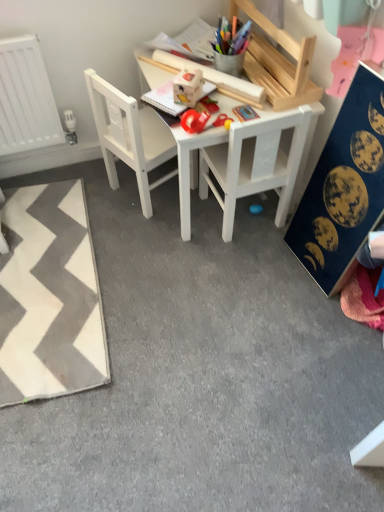
Question: Is white zigzag rug at lower left inside or outside of white wooden table at center?

Choices:
 (A) outside
 (B) inside

Answer: (A)

Question: From a real-world perspective, is white zigzag rug at lower left physically located above or below white wooden table at center?

Choices:
 (A) below
 (B) above

Answer: (A)

Question: Which object is the closest to the white zigzag rug at lower left?

Choices:
 (A) white matte chair at center, which ranks as the 1th chair in left-to-right order
 (B) white wooden table at center
 (C) white matte chair at center, which is the first chair in right-to-left order
 (D) dark blue fabric with celestial prints at right

Answer: (A)

Question: Which object is positioned farthest from the dark blue fabric with celestial prints at right?

Choices:
 (A) white wooden table at center
 (B) white matte chair at center, which ranks as the 1th chair in left-to-right order
 (C) white zigzag rug at lower left
 (D) white matte chair at center, which is the first chair in right-to-left order

Answer: (C)